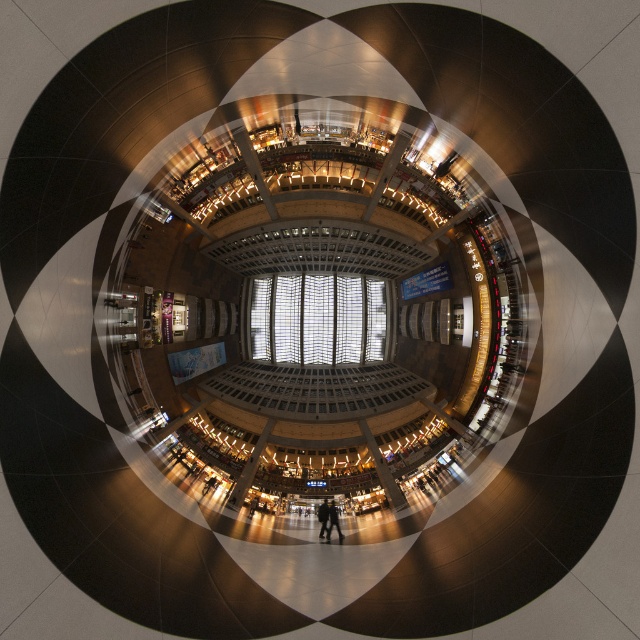
Question: Can you confirm if dark brown leather jacket at center is positioned to the left of dark clothing at center?

Choices:
 (A) no
 (B) yes

Answer: (A)

Question: Does dark brown leather jacket at center have a smaller size compared to dark clothing at center?

Choices:
 (A) yes
 (B) no

Answer: (B)

Question: Does dark brown leather jacket at center have a lesser width compared to dark clothing at center?

Choices:
 (A) yes
 (B) no

Answer: (B)

Question: Which point is farther from the camera taking this photo?

Choices:
 (A) (333, 515)
 (B) (323, 524)

Answer: (A)